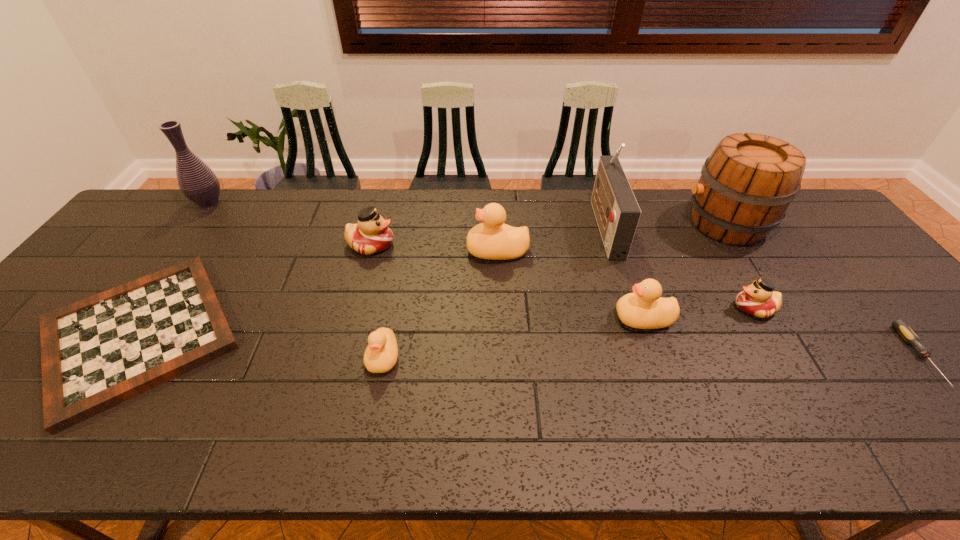
In order to click on free location located 0.210m on the side of the cider where the spigot is located in this screenshot , I will do `click(615, 223)`.

At what (x,y) coordinates should I click in order to perform the action: click on vacant space positioned 0.120m on the side of the cider where the spigot is located. Please return your answer as a coordinate pair (x, y). The image size is (960, 540). Looking at the image, I should click on (643, 223).

Identify the location of vacant position located on the face of the second yellow duck from left to right. (446, 251).

You are a GUI agent. You are given a task and a screenshot of the screen. Output one action in this format:
    pyautogui.click(x=<x>, y=<y>)
    Task: Click on the free space located 0.140m on the face of the second yellow duck from left to right
    Image resolution: width=960 pixels, height=540 pixels.
    Given the screenshot: What is the action you would take?
    pyautogui.click(x=420, y=251)

Image resolution: width=960 pixels, height=540 pixels. What are the coordinates of `free space located 0.230m on the face of the second yellow duck from left to right` in the screenshot? It's located at (389, 251).

Locate an element on the screen. The width and height of the screenshot is (960, 540). free region located on the face of the bigger red duck is located at coordinates (515, 245).

You are a GUI agent. You are given a task and a screenshot of the screen. Output one action in this format:
    pyautogui.click(x=<x>, y=<y>)
    Task: Click on the vacant space situated on the face of the second biggest yellow duck
    This screenshot has width=960, height=540.
    Given the screenshot: What is the action you would take?
    pyautogui.click(x=584, y=318)

I want to click on free location located on the face of the second biggest yellow duck, so click(x=509, y=318).

Identify the location of vacant space located on the face of the second biggest yellow duck. The width and height of the screenshot is (960, 540). (544, 318).

The height and width of the screenshot is (540, 960). In order to click on vacant space positioned 0.180m on the face of the rightmost duck in this screenshot , I will do `click(664, 308)`.